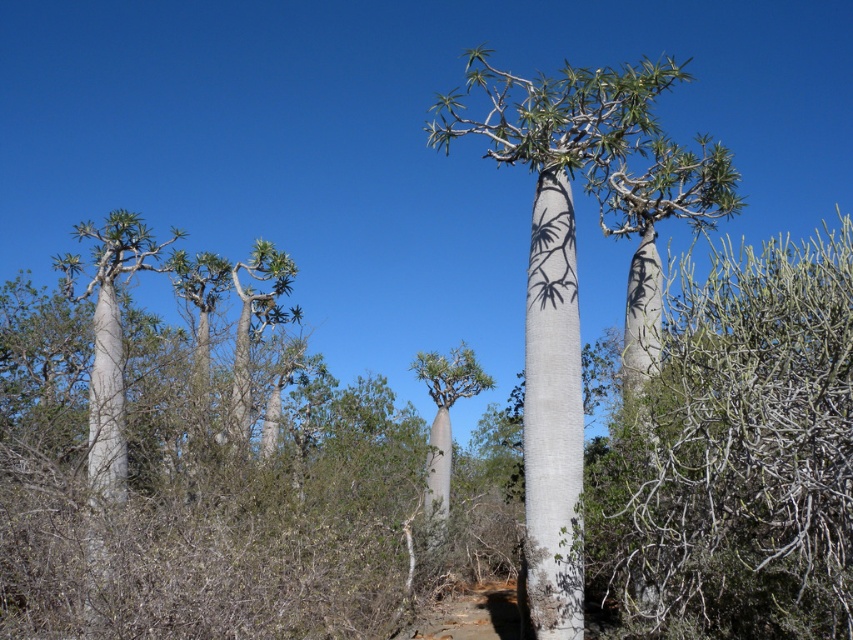
You are an environmental scientist studying tree growth patterns. You observe the white bark tree at center and the green leafy tree at center in this semi arid landscape. Which tree would you expect to have a smaller physical footprint based on their appearance?

The white bark tree at center occupies less space than the green leafy tree at center, so it has a smaller physical footprint.

From the picture: You are planning to place a small bench between the white smooth baobab tree at center and the green leafy tree at center. Based on their widths, which tree would require more space on the bench?

The white smooth baobab tree at center might be wider than the green leafy tree at center, so it would require more space on the bench.